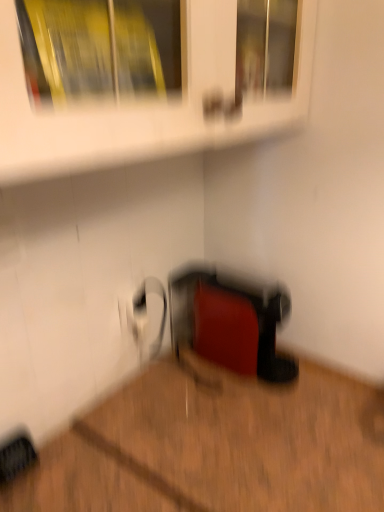
Image resolution: width=384 pixels, height=512 pixels. Identify the location of vacant area situated to the left side of rubberized red toaster at lower center. (175, 374).